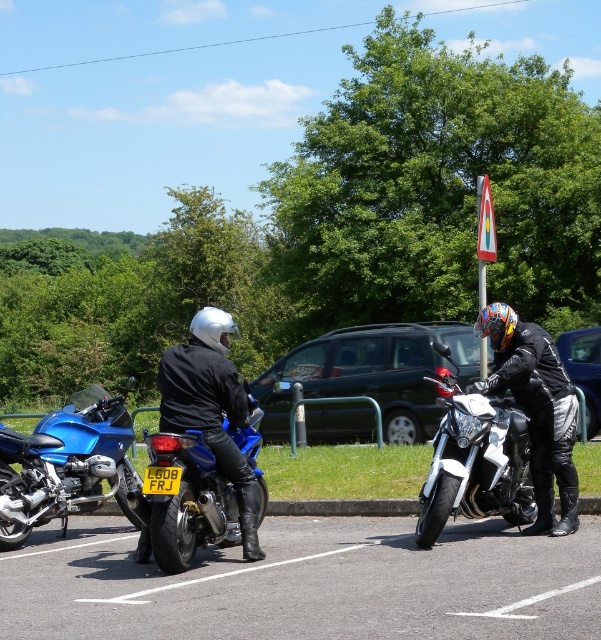
You are a parking attendant and need to park the black rubber motorcycle at lower center and the matte black motorcycle at right in two adjacent spots. The spots are exactly the same width. Can you fit both motorcycles without overlapping?

The black rubber motorcycle at lower center might be wider than matte black motorcycle at right, so there is a possibility that it won not fit into the same width spots. Need to measure first.

You are a delivery person who needs to choose a motorcycle to deliver heavy packages. Both the black rubber motorcycle at lower center and the white glossy motorcycle at center are available. Which motorcycle would be more suitable for carrying heavy loads based on their sizes?

The black rubber motorcycle at lower center has a larger size compared to the white glossy motorcycle at center, making it more suitable for carrying heavy loads due to its increased capacity.

You are a photographer wanting to capture both motorcycles in a single frame. Given that the black rubber motorcycle at lower center is shorter than the matte black motorcycle at right, which motorcycle should you position closer to the camera to ensure both appear equally tall in the photo?

To make both motorcycles appear equally tall in the photo, position the black rubber motorcycle at lower center closer to the camera since it is shorter than the matte black motorcycle at right. This adjustment will balance their apparent sizes in the frame.